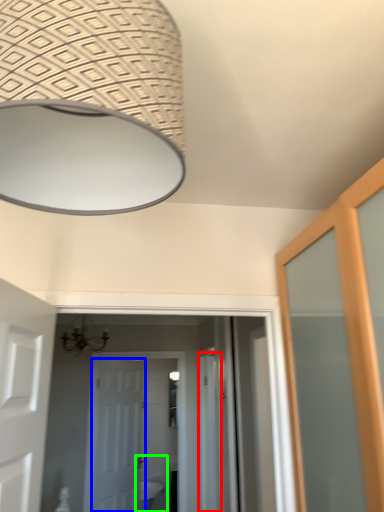
Question: Based on their relative distances, which object is nearer to screen door (highlighted by a red box)? Choose from door (highlighted by a blue box) and sink (highlighted by a green box).

Choices:
 (A) door
 (B) sink

Answer: (A)